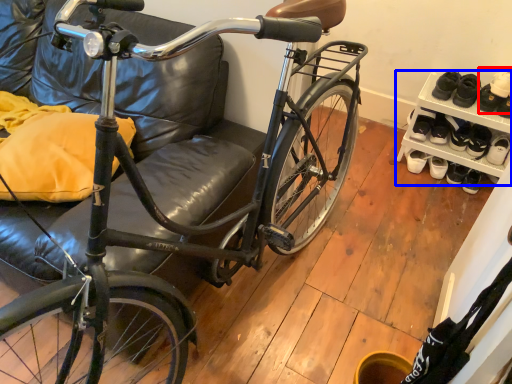
Question: Which of the following is the closest to the observer, shoe (highlighted by a red box) or shelf (highlighted by a blue box)?

Choices:
 (A) shoe
 (B) shelf

Answer: (B)